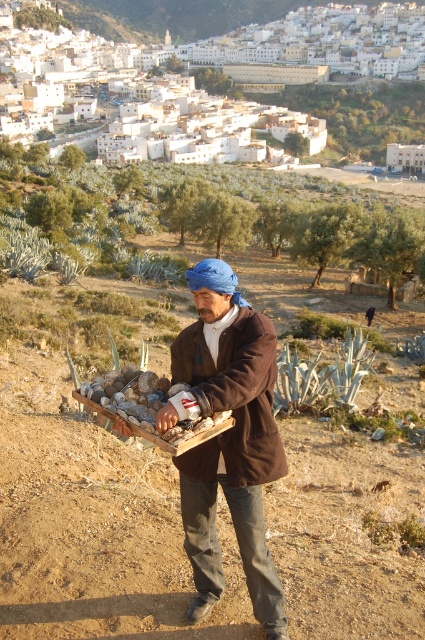
Question: Does brown woolen coat at center appear on the left side of brown woolen jacket at center?

Choices:
 (A) no
 (B) yes

Answer: (A)

Question: Is brown woolen coat at center thinner than brown woolen jacket at center?

Choices:
 (A) no
 (B) yes

Answer: (A)

Question: Which point is farther to the camera?

Choices:
 (A) brown woolen coat at center
 (B) brown woolen jacket at center

Answer: (B)

Question: Which of the following is the closest to the observer?

Choices:
 (A) brown woolen jacket at center
 (B) brown woolen coat at center

Answer: (B)

Question: Considering the relative positions of brown woolen coat at center and brown woolen jacket at center in the image provided, where is brown woolen coat at center located with respect to brown woolen jacket at center?

Choices:
 (A) right
 (B) left

Answer: (A)